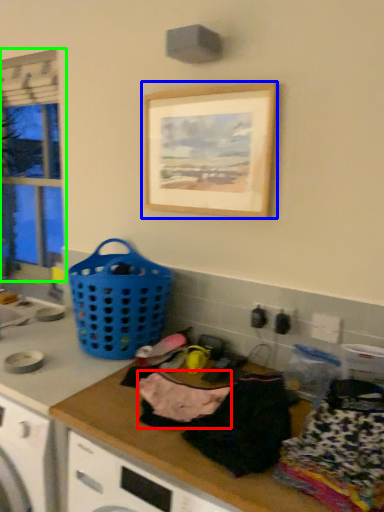
Question: Which object is the closest to the clothing (highlighted by a red box)? Choose among these: picture frame (highlighted by a blue box) or window (highlighted by a green box).

Choices:
 (A) picture frame
 (B) window

Answer: (A)